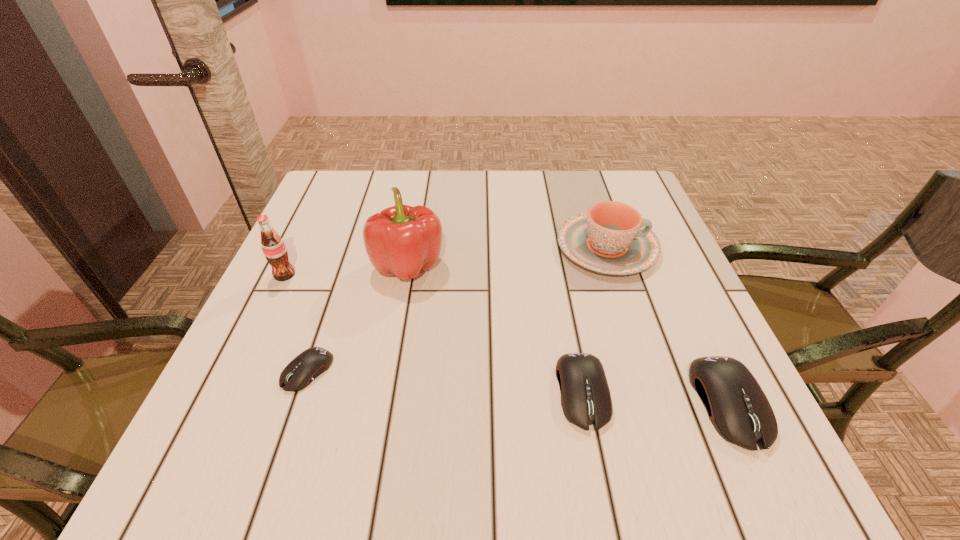
You are a GUI agent. You are given a task and a screenshot of the screen. Output one action in this format:
    pyautogui.click(x=<x>, y=<y>)
    Task: Click on the leftmost computer equipment
    
    Given the screenshot: What is the action you would take?
    pyautogui.click(x=302, y=370)

The width and height of the screenshot is (960, 540). Find the location of `the shortest computer equipment`. the shortest computer equipment is located at coordinates (302, 370).

Where is `the second tallest computer equipment`? The image size is (960, 540). the second tallest computer equipment is located at coordinates (586, 400).

This screenshot has height=540, width=960. What are the coordinates of `the second shortest object` in the screenshot? It's located at (586, 400).

This screenshot has width=960, height=540. What are the coordinates of `the rightmost computer equipment` in the screenshot? It's located at (737, 407).

Where is `the third tallest object`? Image resolution: width=960 pixels, height=540 pixels. the third tallest object is located at coordinates (612, 238).

This screenshot has width=960, height=540. What are the coordinates of `pepper` in the screenshot? It's located at (401, 240).

Identify the location of soda. (273, 247).

At what (x,y) coordinates should I click in order to perform the action: click on vacant space located on the right of the second object from left to right. Please return your answer as a coordinate pair (x, y). This screenshot has width=960, height=540. Looking at the image, I should click on click(455, 371).

I want to click on vacant space located on the right of the second shortest computer equipment, so click(x=684, y=392).